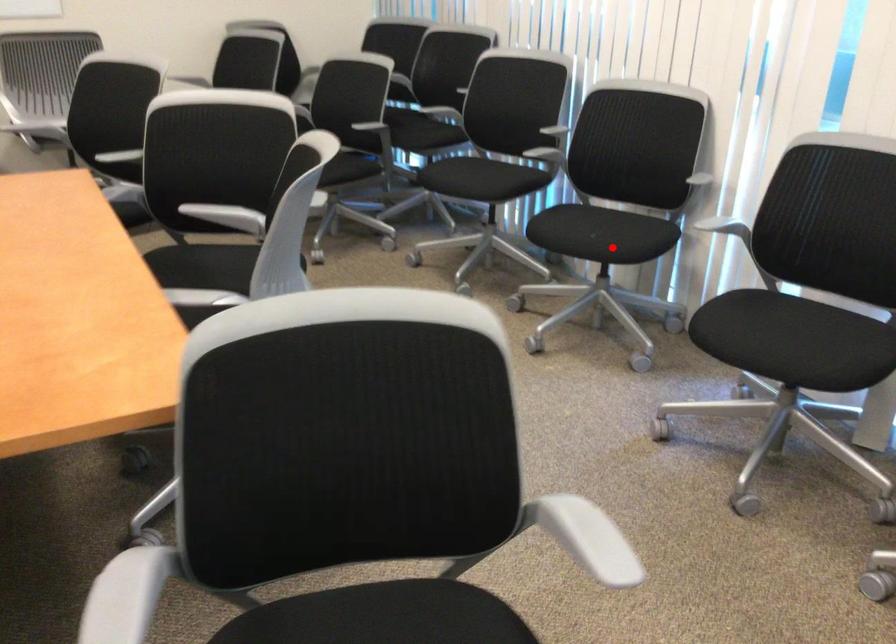
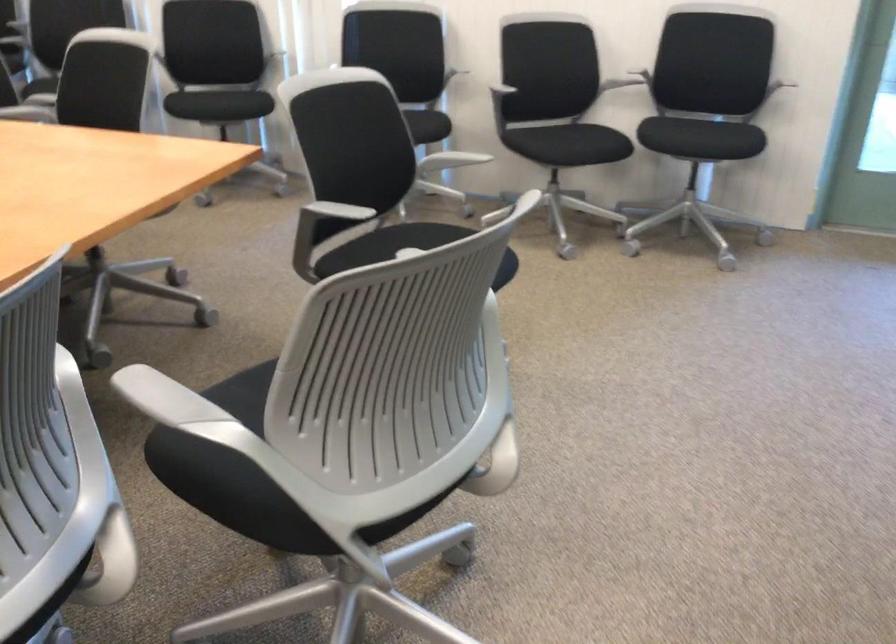
Question: A red point is marked in image1. In image2, is the corresponding 3D point closer to the camera or farther? Reply with the corresponding letter.

Choices:
 (A) The corresponding 3D point is closer.
 (B) The corresponding 3D point is farther.

Answer: (B)